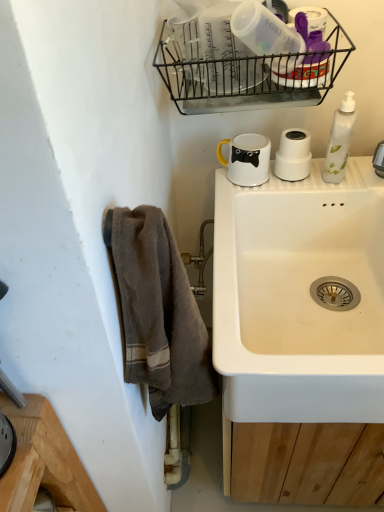
Question: From a real-world perspective, is white glossy bottle at right on top of white glossy mug at upper right?

Choices:
 (A) no
 (B) yes

Answer: (B)

Question: From the image's perspective, is white glossy bottle at right located beneath white glossy mug at upper right?

Choices:
 (A) yes
 (B) no

Answer: (B)

Question: Considering the relative sizes of white glossy bottle at right and white glossy mug at upper right in the image provided, is white glossy bottle at right thinner than white glossy mug at upper right?

Choices:
 (A) yes
 (B) no

Answer: (A)

Question: Can you confirm if white glossy bottle at right is positioned to the left of white glossy mug at upper right?

Choices:
 (A) no
 (B) yes

Answer: (A)

Question: Does white glossy bottle at right appear on the right side of white glossy mug at upper right?

Choices:
 (A) yes
 (B) no

Answer: (A)

Question: Is white glossy bottle at right taller than white glossy mug at upper right?

Choices:
 (A) yes
 (B) no

Answer: (A)

Question: Is white glossy bottle at right looking in the opposite direction of white matte cup at upper right, the 1th appliance when ordered from right to left?

Choices:
 (A) yes
 (B) no

Answer: (A)

Question: Considering the relative sizes of white glossy bottle at right and white matte cup at upper right, the first appliance in the bottom-to-top sequence, in the image provided, is white glossy bottle at right shorter than white matte cup at upper right, the first appliance in the bottom-to-top sequence,?

Choices:
 (A) no
 (B) yes

Answer: (A)

Question: Can you see white glossy bottle at right touching white matte cup at upper right, arranged as the 2th appliance when viewed from the top?

Choices:
 (A) no
 (B) yes

Answer: (B)

Question: From a real-world perspective, is white glossy bottle at right located higher than white matte cup at upper right, the 2th appliance from the front?

Choices:
 (A) no
 (B) yes

Answer: (B)

Question: Can you confirm if white glossy bottle at right is thinner than white matte cup at upper right, which appears as the 1th appliance when viewed from the back?

Choices:
 (A) no
 (B) yes

Answer: (B)

Question: From the image's perspective, does white glossy bottle at right appear lower than white matte cup at upper right, the 1th appliance when ordered from right to left?

Choices:
 (A) yes
 (B) no

Answer: (B)

Question: Is black wire basket at upper center bigger than white glossy mug at upper right?

Choices:
 (A) no
 (B) yes

Answer: (B)